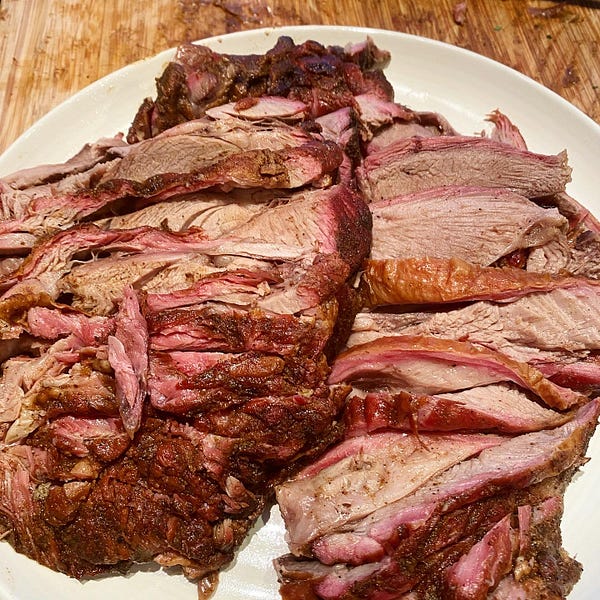
The height and width of the screenshot is (600, 600). I want to click on white plate, so click(x=579, y=525).